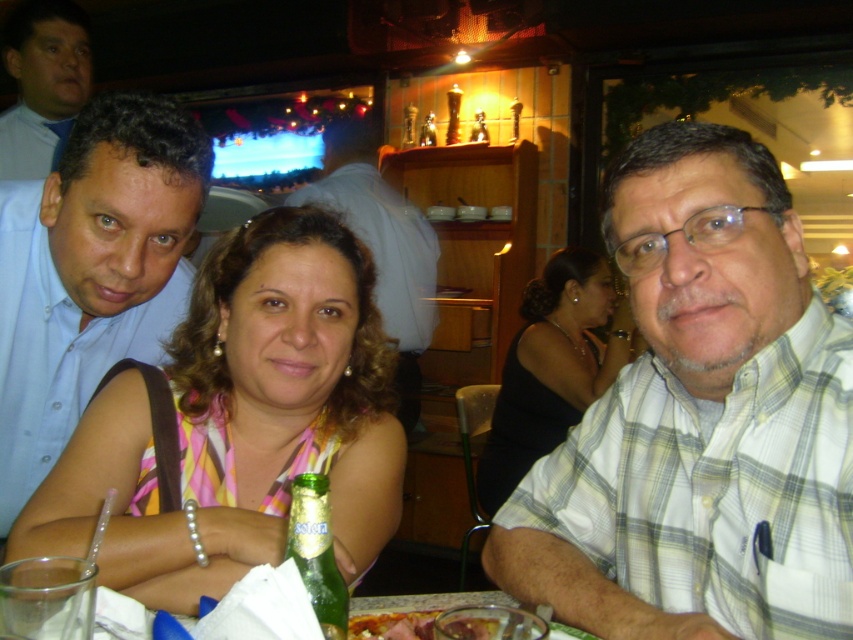
Which is in front, point (9, 545) or point (401, 228)?

Positioned in front is point (9, 545).

Does pink striped dress at center have a lesser width compared to matte blue shirt at center?

Correct, pink striped dress at center's width is less than matte blue shirt at center's.

Is point (241, 451) more distant than point (433, 259)?

No, it is in front of (433, 259).

Locate an element on the screen. pink striped dress at center is located at coordinates (241, 422).

How far apart are white plaid shirt at center and matte blue shirt at upper left?

The distance of white plaid shirt at center from matte blue shirt at upper left is 2.03 meters.

Is white plaid shirt at center closer to camera compared to matte blue shirt at upper left?

Yes.

Is point (723, 532) positioned in front of point (45, 64)?

Yes, it is in front of point (45, 64).

The image size is (853, 640). Identify the location of white plaid shirt at center. (700, 420).

Consider the image. Does green glass bottle at center have a lesser width compared to shiny glass bowl at lower center?

Yes, green glass bottle at center is thinner than shiny glass bowl at lower center.

Between point (296, 513) and point (491, 628), which one is positioned in front?

Point (296, 513) is in front.

Is point (335, 604) behind point (416, 621)?

No, (335, 604) is closer to viewer.

Where is `green glass bottle at center`? The width and height of the screenshot is (853, 640). green glass bottle at center is located at coordinates (316, 552).